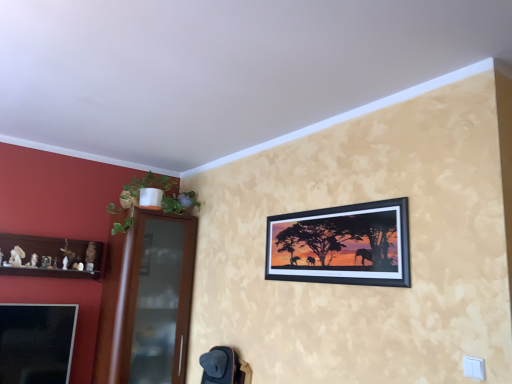
Question: Is point click(x=144, y=286) positioned closer to the camera than point click(x=334, y=271)?

Choices:
 (A) farther
 (B) closer

Answer: (A)

Question: Considering their positions, is brown glass door at left located in front of or behind black matte picture frame at upper center?

Choices:
 (A) behind
 (B) front

Answer: (A)

Question: Estimate the real-world distances between objects in this image. Which object is farther from the black matte picture frame at upper center?

Choices:
 (A) green leafy plant at left
 (B) brown glass door at left
 (C) wooden shelf at left

Answer: (C)

Question: Which object is the farthest from the green leafy plant at left?

Choices:
 (A) black matte picture frame at upper center
 (B) wooden shelf at left
 (C) brown glass door at left

Answer: (A)